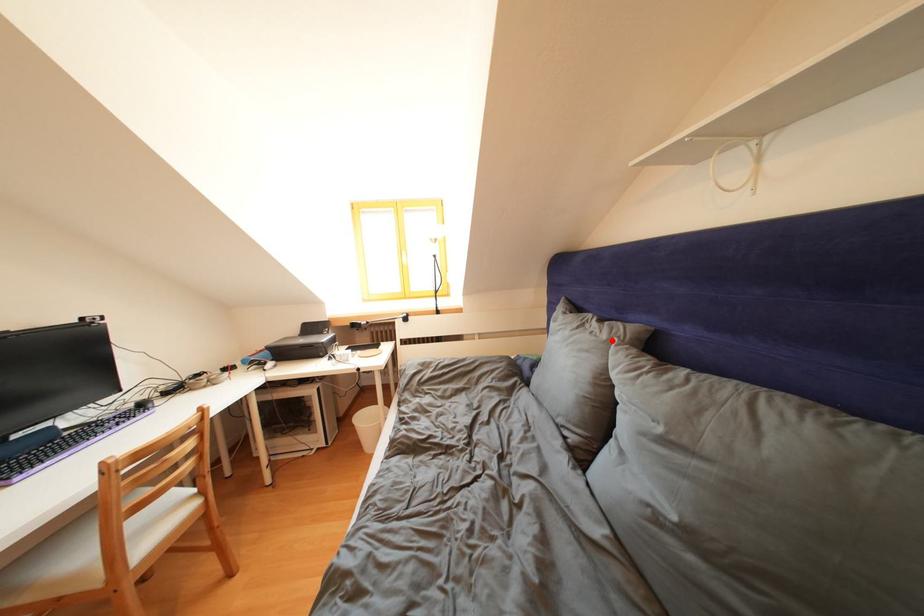
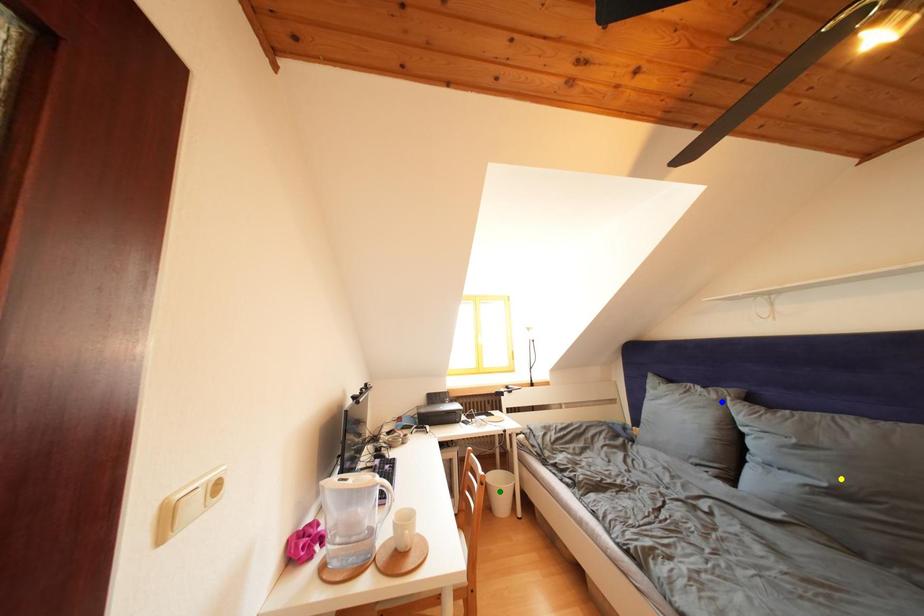
Question: I am providing you with two images of the same scene from different viewpoints. A red point is marked on the first image. You are given multiple points on the second image. Which point in image 2 represents the same 3d spot as the red point in image 1?

Choices:
 (A) yellow point
 (B) blue point
 (C) green point

Answer: (B)